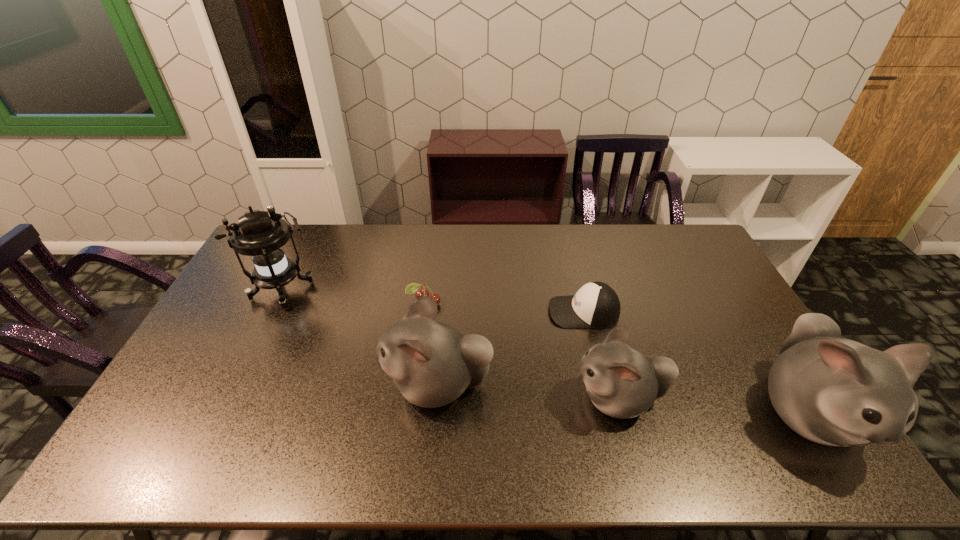
All hamsters are currently evenly spaced. To continue this pattern, where would you add another hamster on the left? Please point out a vacant spot. Please provide its 2D coordinates. Your answer should be formatted as a tuple, i.e. [(x, y)], where the tuple contains the x and y coordinates of a point satisfying the conditions above.

[(268, 372)]